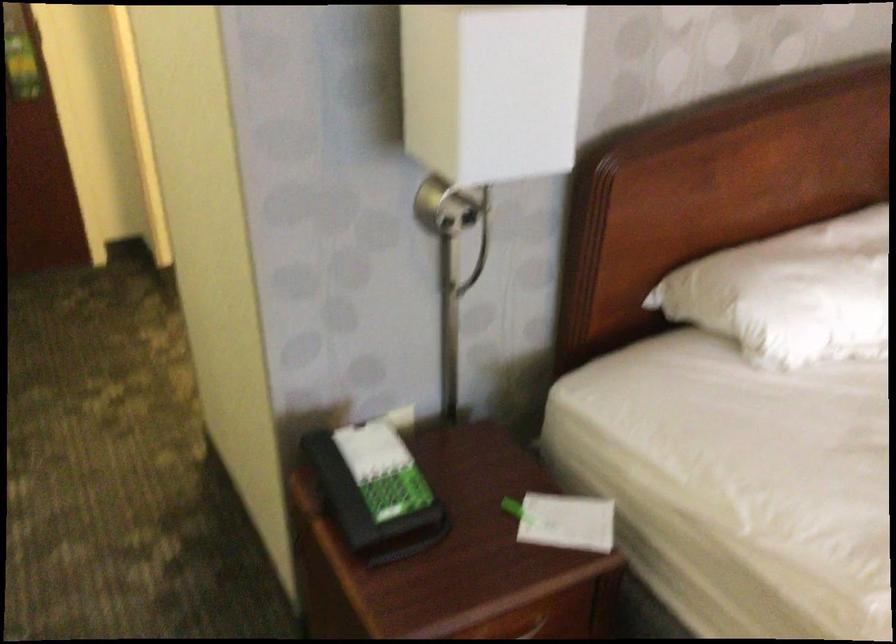
Where is `telephone handset`? The width and height of the screenshot is (896, 644). telephone handset is located at coordinates (375, 491).